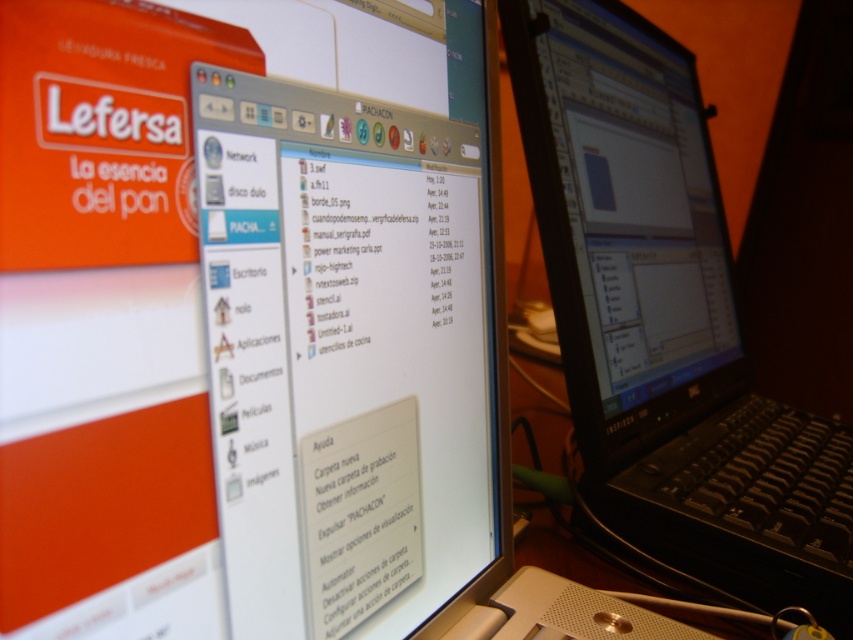
Question: Which object appears closest to the camera in this image?

Choices:
 (A) black plastic laptop at center
 (B) matte black monitor at center

Answer: (A)

Question: Which object appears farthest from the camera in this image?

Choices:
 (A) black plastic laptop at center
 (B) matte black monitor at center

Answer: (B)

Question: Which object is farther from the camera taking this photo?

Choices:
 (A) black plastic laptop at center
 (B) matte black monitor at center

Answer: (B)

Question: Can you confirm if black plastic laptop at center is bigger than matte black monitor at center?

Choices:
 (A) no
 (B) yes

Answer: (B)

Question: Can you confirm if black plastic laptop at center is positioned to the right of matte black monitor at center?

Choices:
 (A) yes
 (B) no

Answer: (A)

Question: From the image, what is the correct spatial relationship of black plastic laptop at center in relation to matte black monitor at center?

Choices:
 (A) right
 (B) left

Answer: (A)